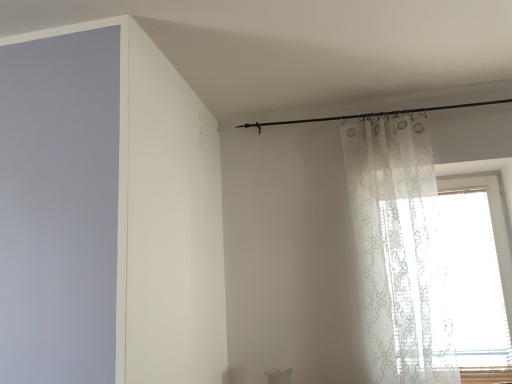
What do you see at coordinates (399, 250) in the screenshot? I see `translucent white curtain at upper right` at bounding box center [399, 250].

Where is `translucent white curtain at upper right`? The width and height of the screenshot is (512, 384). translucent white curtain at upper right is located at coordinates (399, 250).

Measure the distance between translucent white curtain at upper right and camera.

The distance of translucent white curtain at upper right from camera is 2.12 meters.

Describe the element at coordinates (479, 275) in the screenshot. I see `sheer white curtain at right` at that location.

This screenshot has height=384, width=512. I want to click on sheer white curtain at right, so click(479, 275).

I want to click on translucent white curtain at upper right, so (399, 250).

In the scene shown: Considering the relative positions of sheer white curtain at right and translucent white curtain at upper right in the image provided, is sheer white curtain at right to the right of translucent white curtain at upper right from the viewer's perspective?

Correct, you'll find sheer white curtain at right to the right of translucent white curtain at upper right.

Does sheer white curtain at right lie behind translucent white curtain at upper right?

Yes, sheer white curtain at right is further from the camera.

Which is farther from the camera, (482, 284) or (434, 261)?

Point (482, 284)

From the image's perspective, would you say sheer white curtain at right is shown under translucent white curtain at upper right?

Indeed, from the image's perspective, sheer white curtain at right is shown beneath translucent white curtain at upper right.

From a real-world perspective, is sheer white curtain at right above or below translucent white curtain at upper right?

From a real-world perspective, sheer white curtain at right is physically below translucent white curtain at upper right.

Considering the sizes of sheer white curtain at right and translucent white curtain at upper right in the image, is sheer white curtain at right wider or thinner than translucent white curtain at upper right?

sheer white curtain at right is wider than translucent white curtain at upper right.

Which of these two, sheer white curtain at right or translucent white curtain at upper right, stands taller?

Standing taller between the two is translucent white curtain at upper right.

Does sheer white curtain at right have a smaller size compared to translucent white curtain at upper right?

Incorrect, sheer white curtain at right is not smaller in size than translucent white curtain at upper right.

Is translucent white curtain at upper right a part of sheer white curtain at right?

No, translucent white curtain at upper right is not a part of sheer white curtain at right.

Is sheer white curtain at right far from translucent white curtain at upper right?

No, there isn't a large distance between sheer white curtain at right and translucent white curtain at upper right.

Looking at this image, is sheer white curtain at right facing away from translucent white curtain at upper right?

Yes, translucent white curtain at upper right is at the back of sheer white curtain at right.

How many degrees apart are the facing directions of sheer white curtain at right and translucent white curtain at upper right?

The facing directions of sheer white curtain at right and translucent white curtain at upper right are 0.175 degrees apart.

Where is `window on the right of the translucent white curtain at upper right`? window on the right of the translucent white curtain at upper right is located at coordinates (479, 275).

Based on their positions, is translucent white curtain at upper right located to the left or right of sheer white curtain at right?

In the image, translucent white curtain at upper right appears on the left side of sheer white curtain at right.

In the image, is translucent white curtain at upper right positioned in front of or behind sheer white curtain at right?

translucent white curtain at upper right is in front of sheer white curtain at right.

Which point is more distant from viewer, (x=404, y=221) or (x=486, y=315)?

Positioned behind is point (x=486, y=315).

From the image's perspective, is translucent white curtain at upper right below sheer white curtain at right?

Answer: No, from the image's perspective, translucent white curtain at upper right is not below sheer white curtain at right.

From a real-world perspective, is translucent white curtain at upper right over sheer white curtain at right?

Indeed, from a real-world perspective, translucent white curtain at upper right stands above sheer white curtain at right.

Which object is thinner, translucent white curtain at upper right or sheer white curtain at right?

translucent white curtain at upper right is thinner.

Between translucent white curtain at upper right and sheer white curtain at right, which one has less height?

sheer white curtain at right is shorter.

Considering the relative sizes of translucent white curtain at upper right and sheer white curtain at right in the image provided, is translucent white curtain at upper right bigger than sheer white curtain at right?

Incorrect, translucent white curtain at upper right is not larger than sheer white curtain at right.

Would you say translucent white curtain at upper right is outside sheer white curtain at right?

Yes, translucent white curtain at upper right is outside of sheer white curtain at right.

Is translucent white curtain at upper right positioned far away from sheer white curtain at right?

That's not correct — translucent white curtain at upper right is a little close to sheer white curtain at right.

Is translucent white curtain at upper right oriented towards sheer white curtain at right?

No, translucent white curtain at upper right is not facing towards sheer white curtain at right.

Where is `curtain in front of the sheer white curtain at right`? curtain in front of the sheer white curtain at right is located at coordinates (399, 250).

The image size is (512, 384). Identify the location of window below the translucent white curtain at upper right (from a real-world perspective). (479, 275).

Find the location of a particular element. window located below the translucent white curtain at upper right (from the image's perspective) is located at coordinates (479, 275).